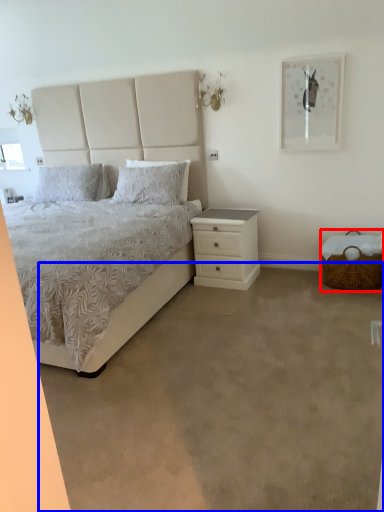
Question: Which object appears farthest to the camera in this image, basket (highlighted by a red box) or plain (highlighted by a blue box)?

Choices:
 (A) basket
 (B) plain

Answer: (A)